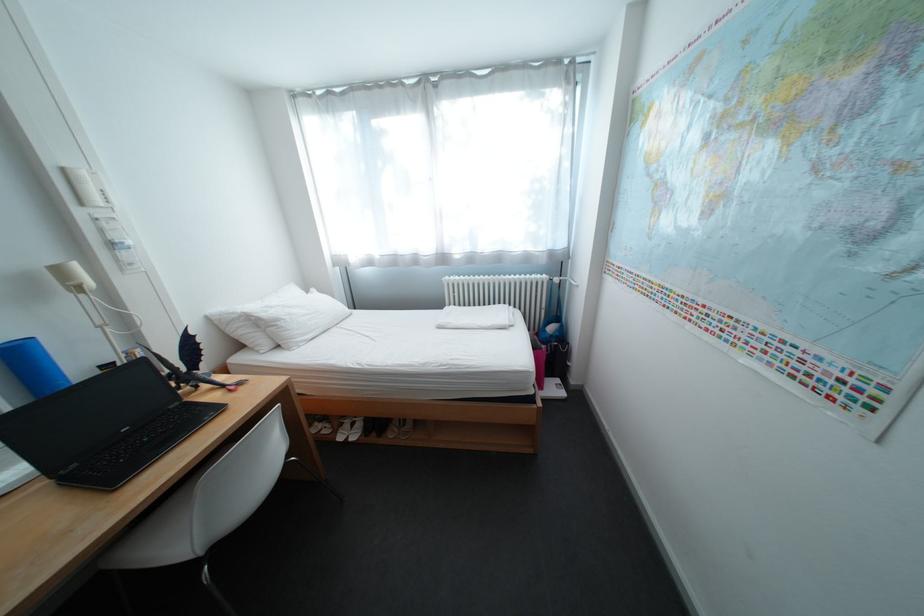
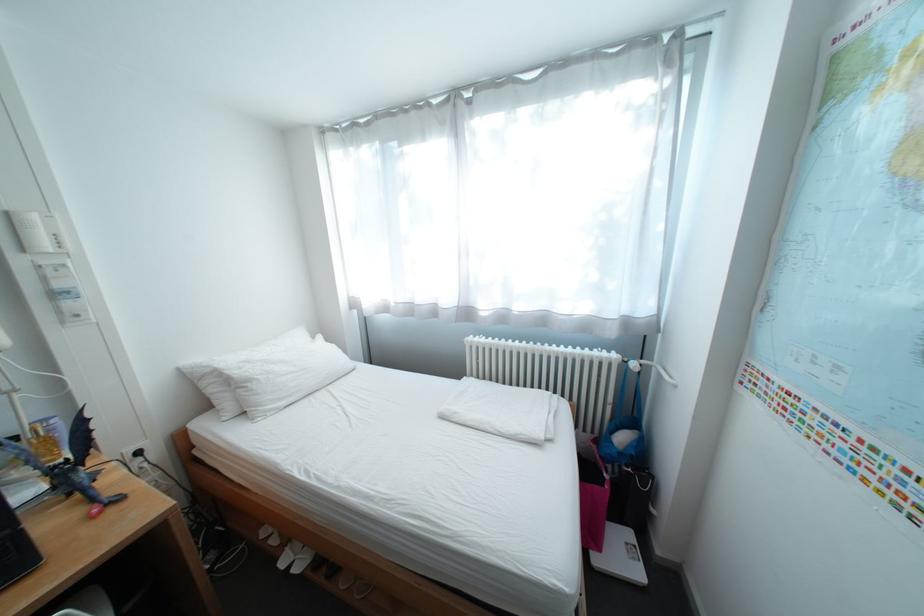
The images are taken continuously from a first-person perspective. In which direction are you moving?

The cameraman moved toward right, forward.